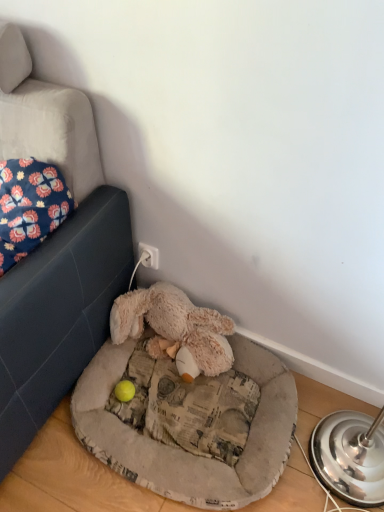
Question: Would you consider floral fabric pillow at upper left to be distant from fluffy beige dog bed at lower center?

Choices:
 (A) yes
 (B) no

Answer: (B)

Question: From the image's perspective, is floral fabric pillow at upper left above fluffy beige dog bed at lower center?

Choices:
 (A) yes
 (B) no

Answer: (A)

Question: Is floral fabric pillow at upper left taller than fluffy beige dog bed at lower center?

Choices:
 (A) yes
 (B) no

Answer: (A)

Question: Does floral fabric pillow at upper left have a larger size compared to fluffy beige dog bed at lower center?

Choices:
 (A) yes
 (B) no

Answer: (A)

Question: From a real-world perspective, is floral fabric pillow at upper left positioned under fluffy beige dog bed at lower center based on gravity?

Choices:
 (A) yes
 (B) no

Answer: (B)

Question: Is point (117, 369) closer or farther from the camera than point (162, 322)?

Choices:
 (A) farther
 (B) closer

Answer: (B)

Question: In terms of width, does fluffy beige dog bed at lower center look wider or thinner when compared to fluffy beige stuffed animal at lower center?

Choices:
 (A) thin
 (B) wide

Answer: (B)

Question: From a real-world perspective, is fluffy beige dog bed at lower center above or below fluffy beige stuffed animal at lower center?

Choices:
 (A) below
 (B) above

Answer: (A)

Question: In the image, is fluffy beige dog bed at lower center on the left side or the right side of fluffy beige stuffed animal at lower center?

Choices:
 (A) left
 (B) right

Answer: (B)

Question: Is fluffy beige stuffed animal at lower center taller or shorter than fluffy beige dog bed at lower center?

Choices:
 (A) tall
 (B) short

Answer: (A)

Question: Which is correct: fluffy beige stuffed animal at lower center is inside fluffy beige dog bed at lower center, or outside of it?

Choices:
 (A) outside
 (B) inside

Answer: (A)

Question: Looking at their shapes, would you say fluffy beige stuffed animal at lower center is wider or thinner than fluffy beige dog bed at lower center?

Choices:
 (A) thin
 (B) wide

Answer: (A)

Question: From the image's perspective, relative to fluffy beige dog bed at lower center, is fluffy beige stuffed animal at lower center above or below?

Choices:
 (A) below
 (B) above

Answer: (B)

Question: In terms of size, does floral fabric pillow at upper left appear bigger or smaller than fluffy beige dog bed at lower center?

Choices:
 (A) small
 (B) big

Answer: (B)

Question: Would you say floral fabric pillow at upper left is to the left or to the right of fluffy beige dog bed at lower center in the picture?

Choices:
 (A) left
 (B) right

Answer: (A)